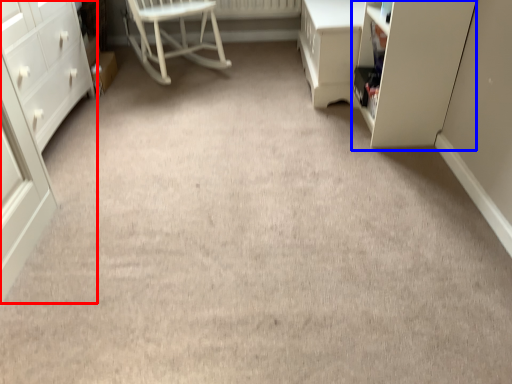
Question: Which point is closer to the camera, chest of drawers (highlighted by a red box) or cabinetry (highlighted by a blue box)?

Choices:
 (A) chest of drawers
 (B) cabinetry

Answer: (A)